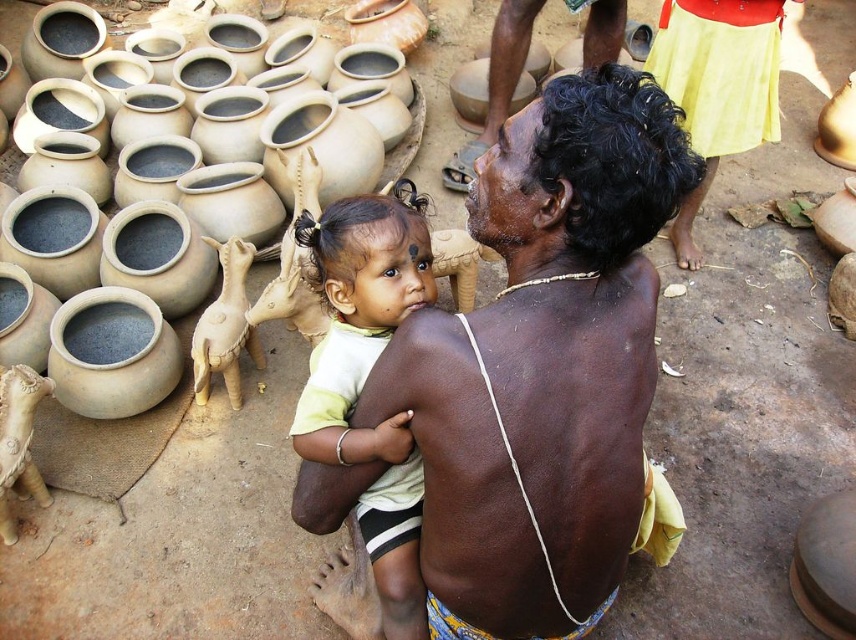
Question: Is yellow cotton skirt at upper right smaller than dark brown skin at upper center?

Choices:
 (A) yes
 (B) no

Answer: (A)

Question: Is matte yellow shirt at center below yellow cotton skirt at upper right?

Choices:
 (A) no
 (B) yes

Answer: (B)

Question: Which of the following is the farthest from the observer?

Choices:
 (A) (604, 13)
 (B) (4, 163)
 (C) (642, 348)

Answer: (B)

Question: Is matte yellow shirt at center to the right of matte clay pot at left from the viewer's perspective?

Choices:
 (A) yes
 (B) no

Answer: (A)

Question: Which object appears closest to the camera in this image?

Choices:
 (A) matte clay pot at left
 (B) yellow cotton skirt at upper right
 (C) dark brown skin at upper center

Answer: (C)

Question: Which of the following is the farthest from the observer?

Choices:
 (A) (396, 596)
 (B) (591, 44)
 (C) (421, 131)

Answer: (C)